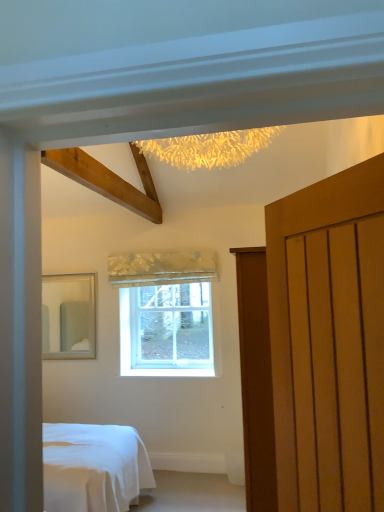
What do you see at coordinates (329, 341) in the screenshot? I see `matte wooden door at right` at bounding box center [329, 341].

Where is `matte silver mirror at left`? matte silver mirror at left is located at coordinates (69, 316).

Find the location of `silky gold curtain at center`. silky gold curtain at center is located at coordinates (162, 268).

Identify the location of matte wooden door at right. Image resolution: width=384 pixels, height=512 pixels. (329, 341).

This screenshot has height=512, width=384. What are the coordinates of `curtain above the matte silver mirror at left (from a real-world perspective)` in the screenshot? It's located at (162, 268).

From a real-world perspective, which is physically above, matte silver mirror at left or silky gold curtain at center?

silky gold curtain at center, from a real-world perspective.

Considering the sizes of objects matte silver mirror at left and silky gold curtain at center in the image provided, who is bigger, matte silver mirror at left or silky gold curtain at center?

matte silver mirror at left.

Consider the image. Can you tell me how much matte silver mirror at left and silky gold curtain at center differ in facing direction?

0.000869 degrees separate the facing orientations of matte silver mirror at left and silky gold curtain at center.

Which is correct: matte wooden door at right is inside silky gold curtain at center, or outside of it?

matte wooden door at right cannot be found inside silky gold curtain at center.

Where is `curtain that is behind the matte wooden door at right`? The image size is (384, 512). curtain that is behind the matte wooden door at right is located at coordinates (162, 268).

Which is farther, (306,326) or (211,263)?

Point (211,263)

Considering the sizes of objects matte wooden door at right and silky gold curtain at center in the image provided, who is smaller, matte wooden door at right or silky gold curtain at center?

silky gold curtain at center is smaller.

Is matte silver mirror at left wider or thinner than clear glass window at center?

Clearly, matte silver mirror at left has more width compared to clear glass window at center.

Based on the photo, are matte silver mirror at left and clear glass window at center making contact?

There is a gap between matte silver mirror at left and clear glass window at center.

From the image's perspective, between matte silver mirror at left and clear glass window at center, which one is located above?

From the image's view, matte silver mirror at left is above.

Which is more to the left, matte silver mirror at left or clear glass window at center?

Positioned to the left is matte silver mirror at left.

Considering the positions of point (155, 339) and point (77, 348), is point (155, 339) closer or farther from the camera than point (77, 348)?

Clearly, point (155, 339) is more distant from the camera than point (77, 348).

Based on the photo, measure the distance from clear glass window at center to matte silver mirror at left.

clear glass window at center is 28.31 inches from matte silver mirror at left.

Consider the image. From the image's perspective, is clear glass window at center located above or below matte silver mirror at left?

clear glass window at center is below matte silver mirror at left.

Can you confirm if clear glass window at center is shorter than matte silver mirror at left?

Yes.

Can you confirm if clear glass window at center is wider than matte wooden door at right?

Incorrect, the width of clear glass window at center does not surpass that of matte wooden door at right.

Who is taller, clear glass window at center or matte wooden door at right?

With more height is matte wooden door at right.

Based on the photo, from a real-world perspective, is clear glass window at center above or below matte wooden door at right?

From a real-world perspective, clear glass window at center is physically below matte wooden door at right.

From a real-world perspective, between matte wooden door at right and clear glass window at center, who is vertically higher?

matte wooden door at right, from a real-world perspective.

Which of these two, matte wooden door at right or clear glass window at center, stands taller?

Standing taller between the two is matte wooden door at right.

Which object is thinner, matte wooden door at right or clear glass window at center?

clear glass window at center is thinner.

Which of these two, matte wooden door at right or clear glass window at center, is bigger?

matte wooden door at right.

Is silky gold curtain at center facing away from matte silver mirror at left?

No.

This screenshot has width=384, height=512. Find the location of `mirror lying behind the silky gold curtain at center`. mirror lying behind the silky gold curtain at center is located at coordinates (69, 316).

Can you confirm if silky gold curtain at center is smaller than matte silver mirror at left?

Correct, silky gold curtain at center occupies less space than matte silver mirror at left.

Considering the positions of objects silky gold curtain at center and matte silver mirror at left in the image provided, who is more to the left, silky gold curtain at center or matte silver mirror at left?

Positioned to the left is matte silver mirror at left.

This screenshot has height=512, width=384. I want to click on mirror that is under the silky gold curtain at center (from a real-world perspective), so click(69, 316).

You are a GUI agent. You are given a task and a screenshot of the screen. Output one action in this format:
    pyautogui.click(x=<x>, y=<y>)
    Task: Click on the curtain that appears on the left of matte wooden door at right
    This screenshot has height=512, width=384.
    Given the screenshot: What is the action you would take?
    pyautogui.click(x=162, y=268)

Looking at the image, which one is located closer to matte silver mirror at left, silky gold curtain at center or clear glass window at center?

Based on the image, silky gold curtain at center appears to be nearer to matte silver mirror at left.

From the image, which object appears to be nearer to clear glass window at center, matte wooden door at right or matte silver mirror at left?

The object closer to clear glass window at center is matte silver mirror at left.

Based on the photo, considering their positions, is clear glass window at center positioned further to matte wooden door at right than matte silver mirror at left?

matte silver mirror at left is positioned further to the anchor matte wooden door at right.

From the picture: Considering their positions, is matte wooden door at right positioned closer to silky gold curtain at center than clear glass window at center?

clear glass window at center is positioned closer to the anchor silky gold curtain at center.

Based on the photo, based on their spatial positions, is clear glass window at center or matte silver mirror at left further from silky gold curtain at center?

Based on the image, matte silver mirror at left appears to be further to silky gold curtain at center.

Based on their spatial positions, is matte wooden door at right or matte silver mirror at left further from silky gold curtain at center?

matte wooden door at right.

Considering their positions, is silky gold curtain at center positioned closer to matte wooden door at right than matte silver mirror at left?

silky gold curtain at center is positioned closer to the anchor matte wooden door at right.

Estimate the real-world distances between objects in this image. Which object is closer to matte silver mirror at left, matte wooden door at right or clear glass window at center?

The object closer to matte silver mirror at left is clear glass window at center.

Locate an element on the screen. The width and height of the screenshot is (384, 512). curtain between matte wooden door at right and clear glass window at center in the front-back direction is located at coordinates (162, 268).

The image size is (384, 512). I want to click on curtain between matte silver mirror at left and clear glass window at center from left to right, so click(x=162, y=268).

At what (x,y) coordinates should I click in order to perform the action: click on curtain located between matte wooden door at right and matte silver mirror at left in the depth direction. Please return your answer as a coordinate pair (x, y). Looking at the image, I should click on (162, 268).

The image size is (384, 512). I want to click on mirror between matte wooden door at right and clear glass window at center from front to back, so click(x=69, y=316).